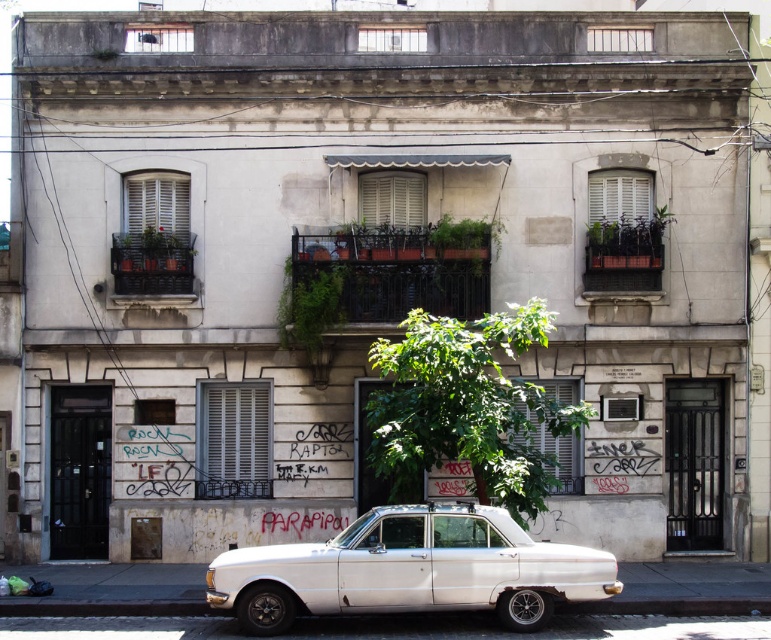
You are a delivery person standing next to the white matte car at lower center. You need to deliver a package to the building. The entrance is through the door on the right. Can you drive your car directly to the door on the right without hitting the green leafy tree at center?

The white matte car at lower center is 1.21 meters away from the green leafy tree at center. Since the car needs to maneuver towards the door on the right, this distance might be too narrow to safely navigate around the tree without collision. Therefore, it is not advisable to drive the car directly to the door on the right.

You are driving a white matte car at lower center and need to park it in a space that can only accommodate vehicles up to 1.8 meters in width. There is a green leafy tree at center nearby. Can you safely park your car in this space without hitting the tree?

The white matte car at lower center might be wider than the 1.8 meters limit. Since the car might be wider than the allowed space, there is a risk of hitting the tree when parking. It is safer to choose a wider parking spot.

What is the position of the white matte car at lower center relative to the green leafy tree at center?

The white matte car at lower center is positioned to the left of the green leafy tree at center.